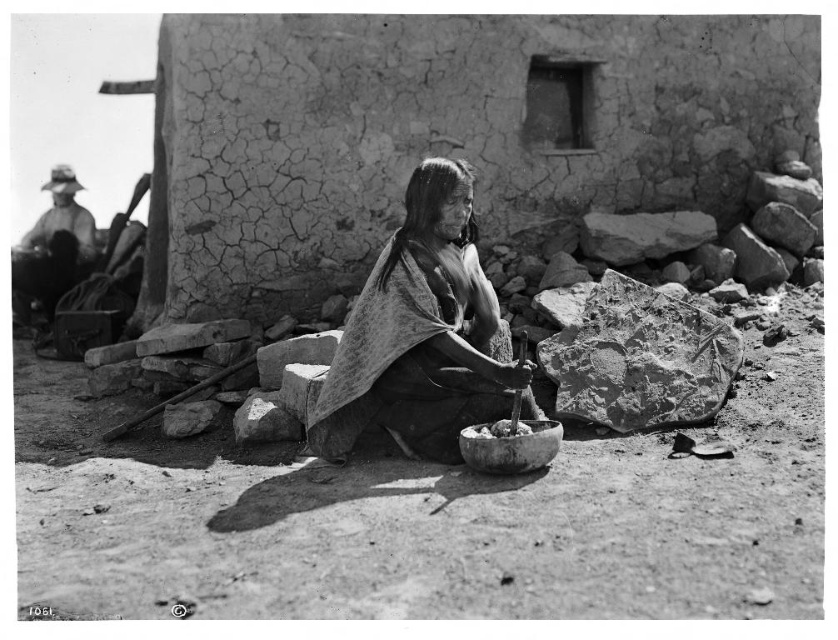
Question: Which object is closer to the camera taking this photo?

Choices:
 (A) smooth fabric shawl at center
 (B) rugged fabric hat at left

Answer: (A)

Question: Is rugged fabric hat at left thinner than smooth clay bowl at center?

Choices:
 (A) yes
 (B) no

Answer: (B)

Question: Which point appears farthest from the camera in this image?

Choices:
 (A) (515, 433)
 (B) (493, 330)
 (C) (47, 211)
 (D) (526, 426)

Answer: (C)

Question: Among these points, which one is farthest from the camera?

Choices:
 (A) (392, 385)
 (B) (516, 432)
 (C) (18, 298)

Answer: (C)

Question: Can you confirm if smooth fabric shawl at center is wider than rugged fabric hat at left?

Choices:
 (A) no
 (B) yes

Answer: (A)

Question: Does smooth clay bowl at center have a greater width compared to smooth white stones at center?

Choices:
 (A) yes
 (B) no

Answer: (A)